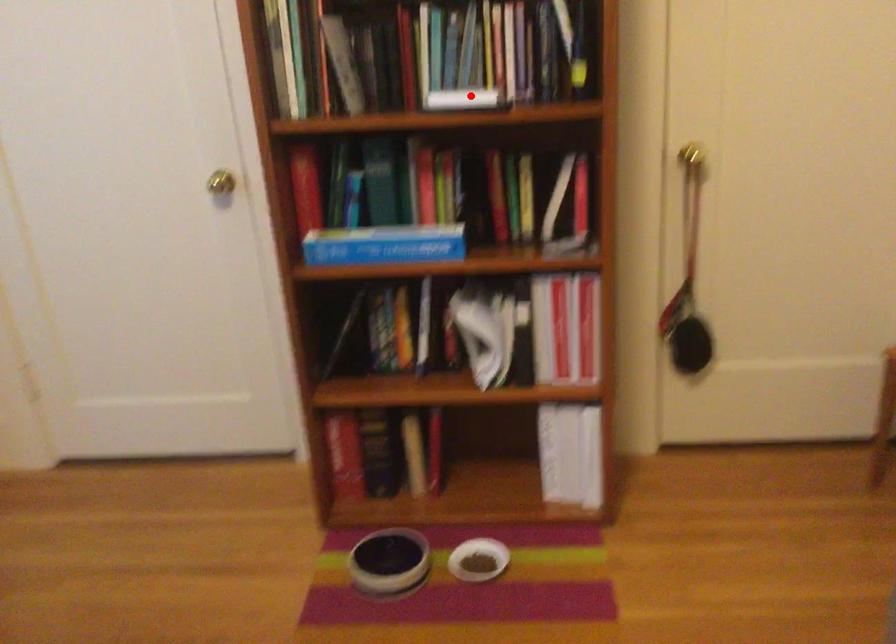
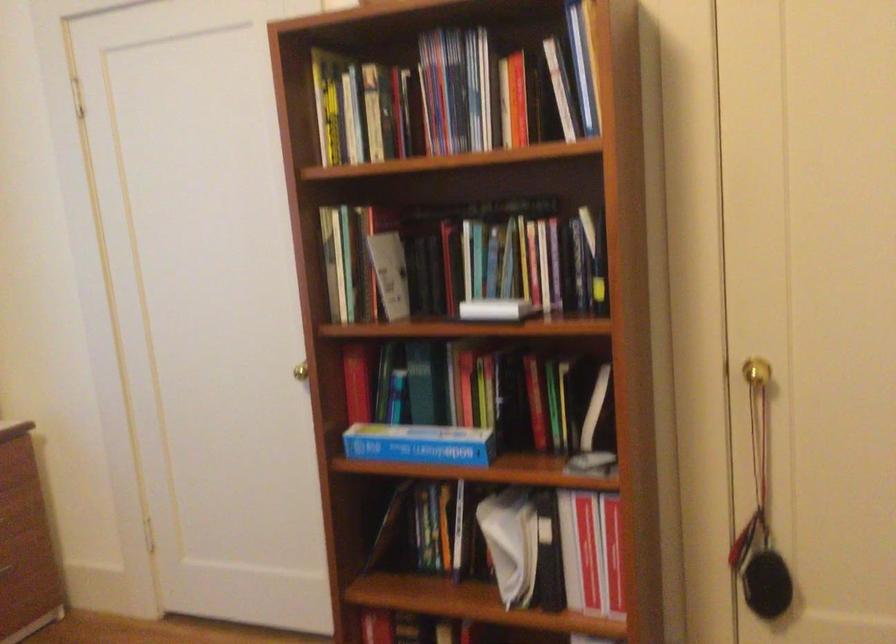
Locate, in the second image, the point that corresponds to the highlighted location in the first image.

(495, 308)